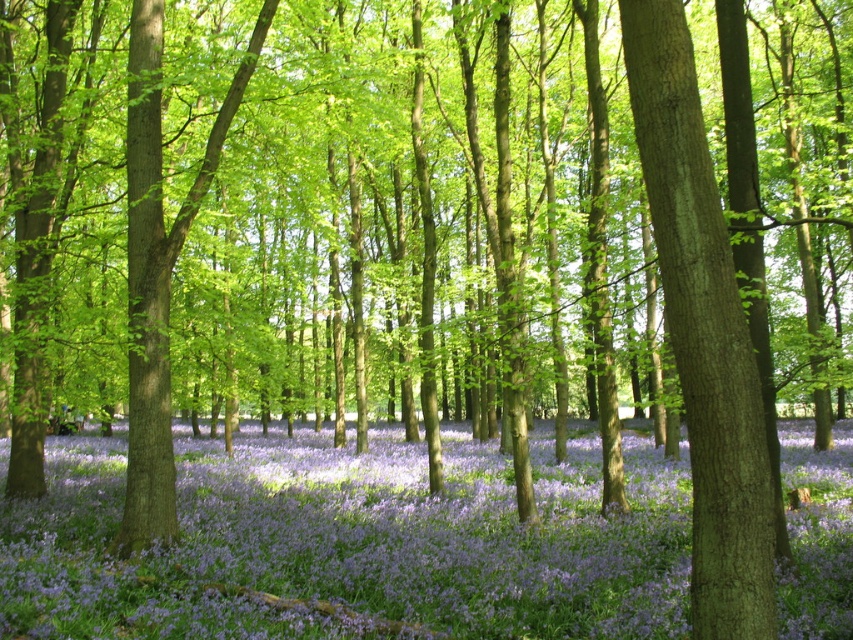
Question: Which point is farther to the camera?

Choices:
 (A) (666, 310)
 (B) (541, 451)

Answer: (B)

Question: Which of the following is the closest to the observer?

Choices:
 (A) (233, 481)
 (B) (654, 26)

Answer: (B)

Question: Is purple matte flower at center in front of green rough bark tree at center?

Choices:
 (A) yes
 (B) no

Answer: (B)

Question: Which of the following is the farthest from the observer?

Choices:
 (A) purple matte flower at center
 (B) green rough bark tree at center

Answer: (A)

Question: Can you confirm if purple matte flower at center is bigger than green rough bark tree at center?

Choices:
 (A) yes
 (B) no

Answer: (A)

Question: Does purple matte flower at center have a smaller size compared to green rough bark tree at center?

Choices:
 (A) no
 (B) yes

Answer: (A)